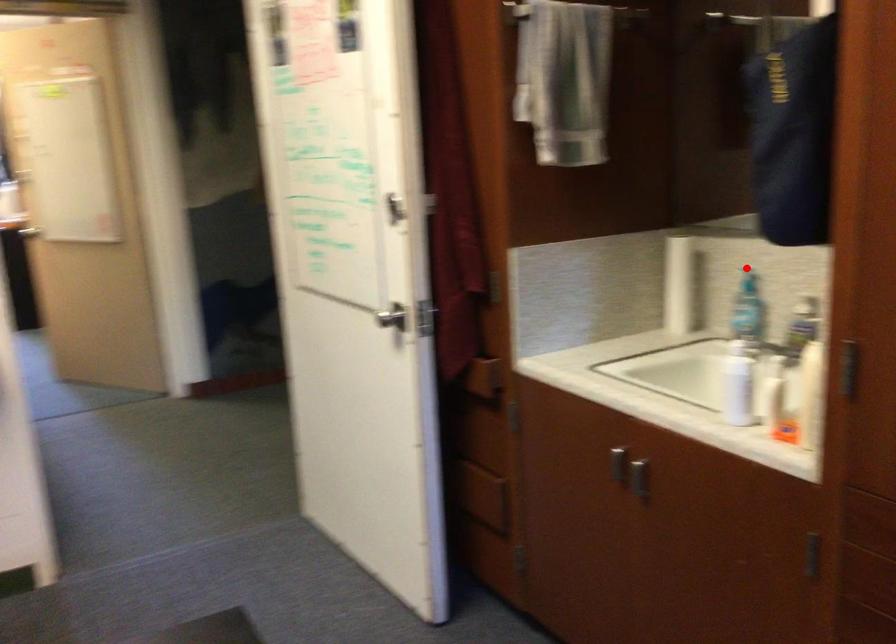
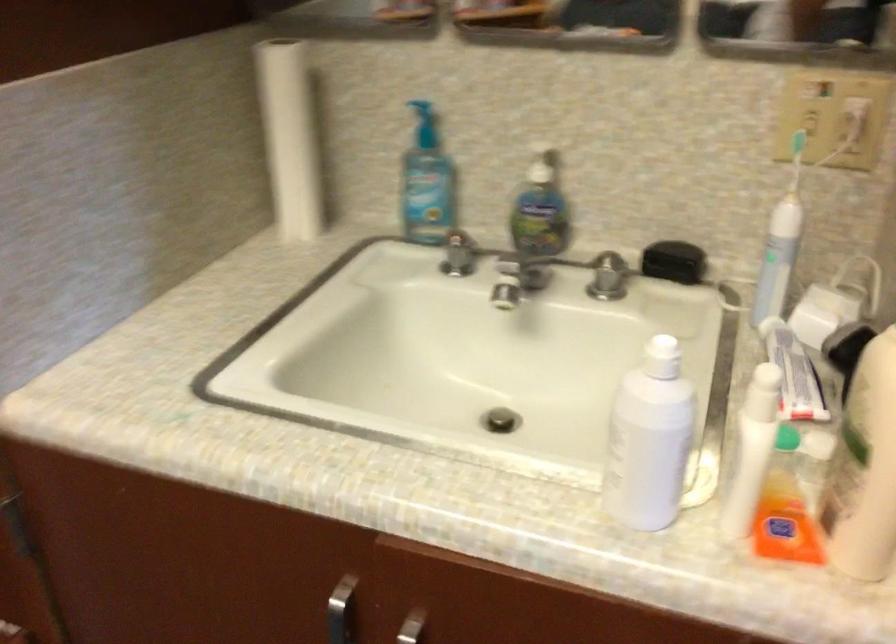
Question: A red point is marked in image1. In image2, is the corresponding 3D point closer to the camera or farther? Reply with the corresponding letter.

Choices:
 (A) The corresponding 3D point is closer.
 (B) The corresponding 3D point is farther.

Answer: (A)